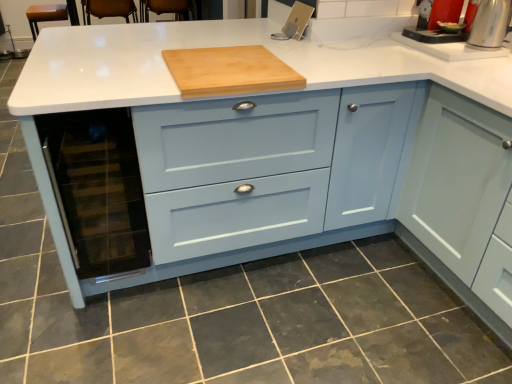
Where is `vacant space that is to the left of transparent glass wine cooler at lower left`? The image size is (512, 384). vacant space that is to the left of transparent glass wine cooler at lower left is located at coordinates [x=46, y=302].